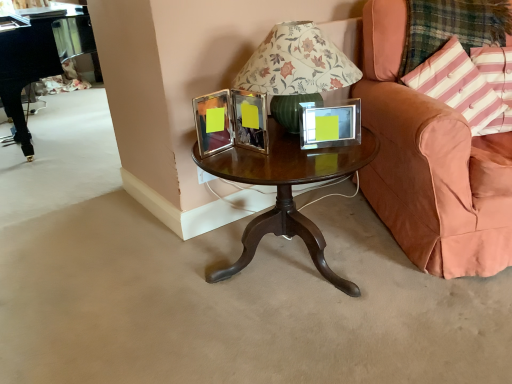
Question: Does peach velvet chair at right contain plaid fabric at right?

Choices:
 (A) yes
 (B) no

Answer: (A)

Question: From a real-world perspective, is peach velvet chair at right on top of plaid fabric at right?

Choices:
 (A) no
 (B) yes

Answer: (A)

Question: Is peach velvet chair at right located outside plaid fabric at right?

Choices:
 (A) yes
 (B) no

Answer: (A)

Question: Does peach velvet chair at right come in front of plaid fabric at right?

Choices:
 (A) no
 (B) yes

Answer: (B)

Question: Can you confirm if peach velvet chair at right is positioned to the left of plaid fabric at right?

Choices:
 (A) yes
 (B) no

Answer: (B)

Question: Is peach velvet chair at right turned away from plaid fabric at right?

Choices:
 (A) yes
 (B) no

Answer: (A)

Question: From the image's perspective, does peach velvet chair at right appear higher than clear glass picture frame at center?

Choices:
 (A) no
 (B) yes

Answer: (B)

Question: Is peach velvet chair at right facing away from clear glass picture frame at center?

Choices:
 (A) yes
 (B) no

Answer: (B)

Question: Is peach velvet chair at right smaller than clear glass picture frame at center?

Choices:
 (A) no
 (B) yes

Answer: (A)

Question: Does peach velvet chair at right have a lesser height compared to clear glass picture frame at center?

Choices:
 (A) no
 (B) yes

Answer: (A)

Question: Is peach velvet chair at right oriented towards clear glass picture frame at center?

Choices:
 (A) yes
 (B) no

Answer: (B)

Question: Is clear glass picture frame at center completely or partially inside peach velvet chair at right?

Choices:
 (A) no
 (B) yes

Answer: (A)

Question: Is pink striped fabric pillow at right, which is counted as the first pillow, starting from the right, at the left side of peach velvet chair at right?

Choices:
 (A) no
 (B) yes

Answer: (A)